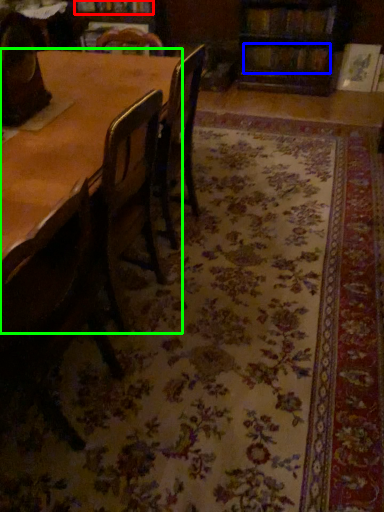
Question: Estimate the real-world distances between objects in this image. Which object is farther from book (highlighted by a red box), book (highlighted by a blue box) or table (highlighted by a green box)?

Choices:
 (A) book
 (B) table

Answer: (B)